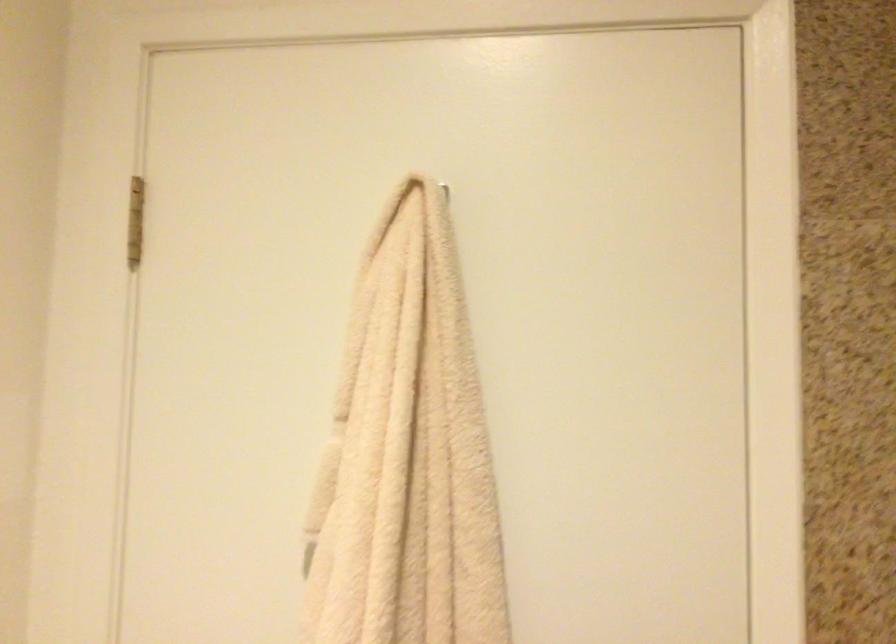
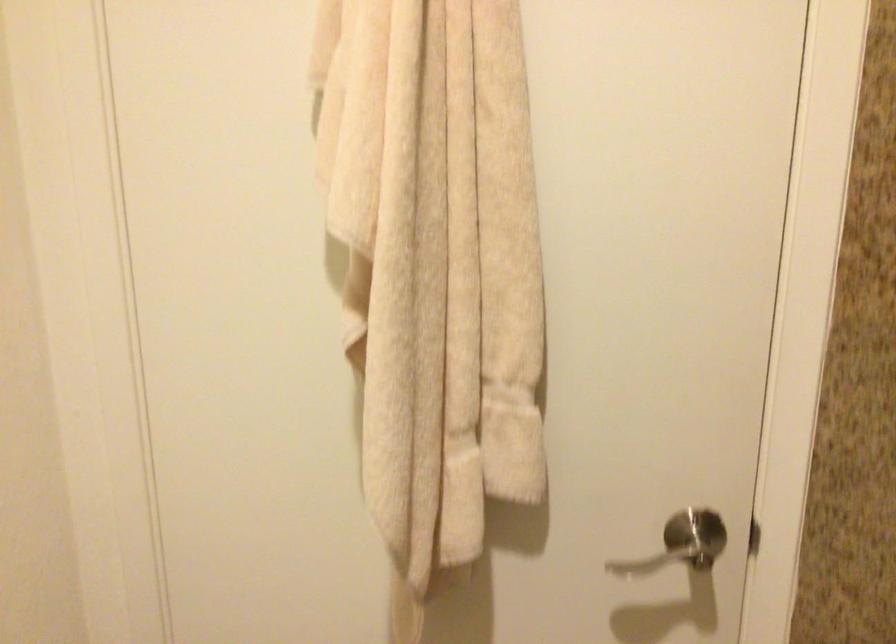
Which direction would the cameraman need to move to produce the second image?

The cameraman moved toward left, forward.